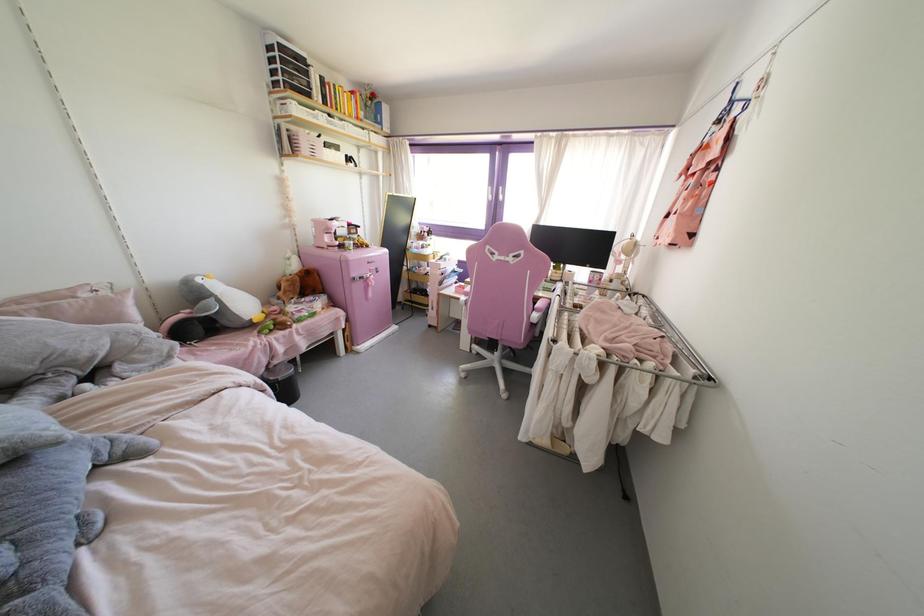
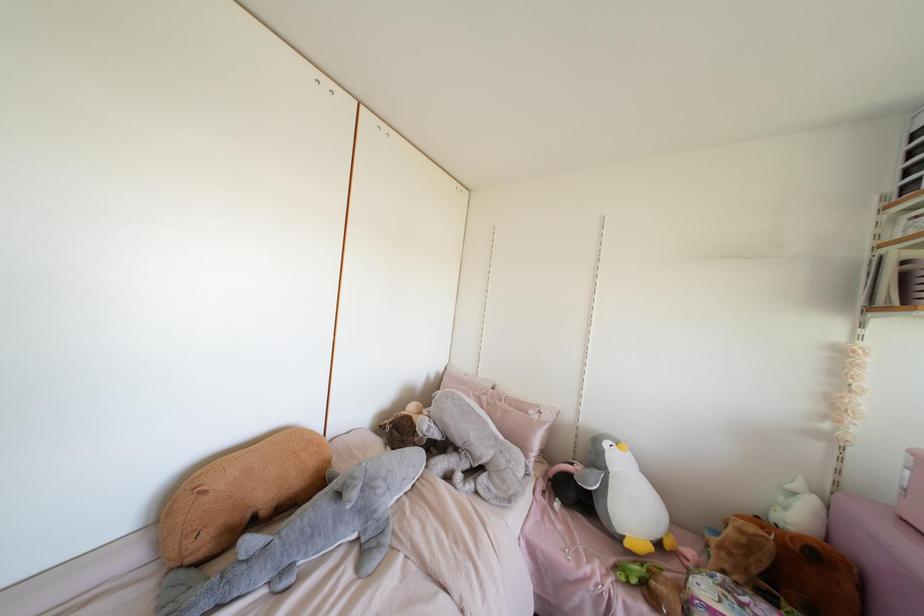
Where in the second image is the point corresponding to pixel 254 320 from the first image?

(626, 544)